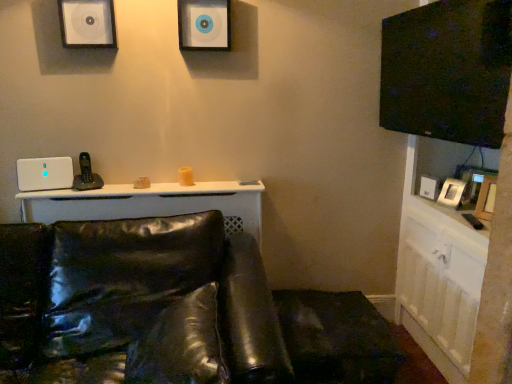
Question: In terms of height, does white plastic speaker at left, which is the first speaker from left to right, look taller or shorter compared to white glossy dresser at right?

Choices:
 (A) short
 (B) tall

Answer: (A)

Question: Is white plastic speaker at left, which appears as the third speaker when viewed from the right, spatially inside white glossy dresser at right, or outside of it?

Choices:
 (A) inside
 (B) outside

Answer: (B)

Question: Considering the real-world distances, which object is farthest from the matte white speaker at upper center, the first speaker from the right?

Choices:
 (A) white plastic speaker at left, placed as the 1th speaker when sorted from bottom to top
 (B) glossy leather couch at lower left
 (C) white glossy dresser at right
 (D) white matte speaker at upper left, placed as the 2th speaker when sorted from left to right

Answer: (C)

Question: Estimate the real-world distances between objects in this image. Which object is closer to the glossy leather couch at lower left?

Choices:
 (A) white matte speaker at upper left, marked as the second speaker in a top-to-bottom arrangement
 (B) white glossy dresser at right
 (C) white plastic speaker at left, placed as the 1th speaker when sorted from bottom to top
 (D) matte white speaker at upper center, the 3th speaker positioned from the bottom

Answer: (C)